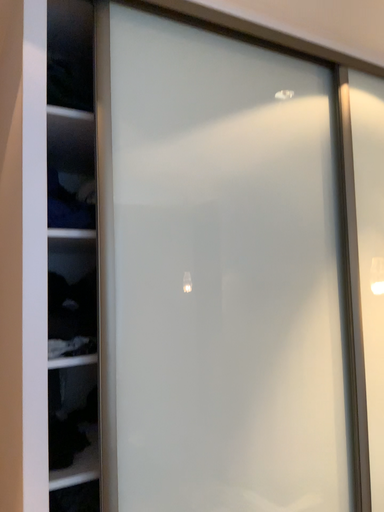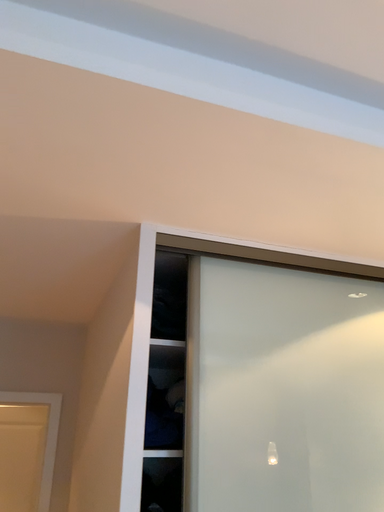
Question: How did the camera likely rotate when shooting the video?

Choices:
 (A) rotated downward
 (B) rotated upward

Answer: (B)